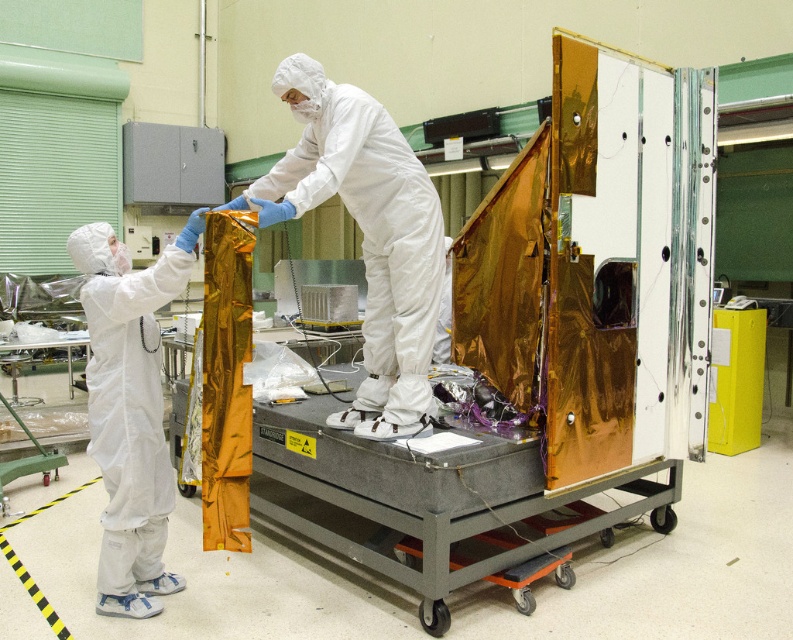
Question: Is white matte suit at center in front of white matte suit at left?

Choices:
 (A) no
 (B) yes

Answer: (B)

Question: Among these objects, which one is farthest from the camera?

Choices:
 (A) white matte suit at left
 (B) white matte suit at center

Answer: (A)

Question: Which object appears closest to the camera in this image?

Choices:
 (A) white matte suit at left
 (B) white matte suit at center

Answer: (B)

Question: Does white matte suit at center have a larger size compared to white matte suit at left?

Choices:
 (A) yes
 (B) no

Answer: (A)

Question: Where is white matte suit at center located in relation to white matte suit at left in the image?

Choices:
 (A) right
 (B) left

Answer: (A)